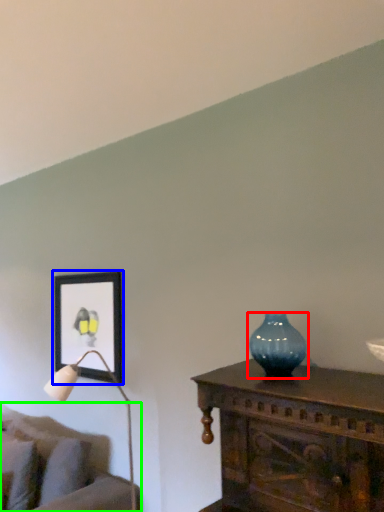
Question: Estimate the real-world distances between objects in this image. Which object is closer to vase (highlighted by a red box), picture frame (highlighted by a blue box) or studio couch (highlighted by a green box)?

Choices:
 (A) picture frame
 (B) studio couch

Answer: (A)